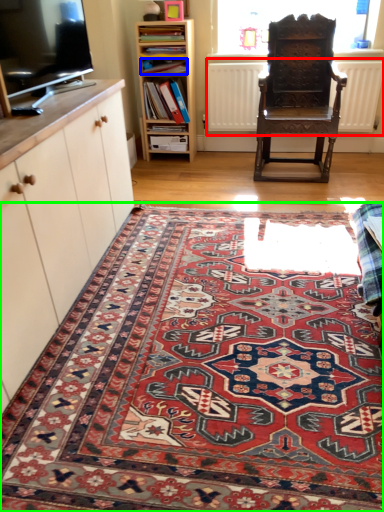
Question: Based on their relative distances, which object is nearer to radiator (highlighted by a red box)? Choose from book (highlighted by a blue box) and mat (highlighted by a green box).

Choices:
 (A) book
 (B) mat

Answer: (A)